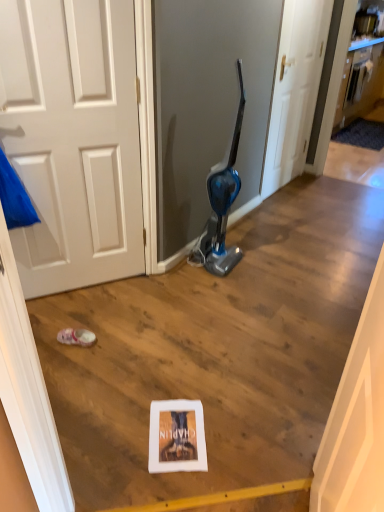
Question: Is wooden cabinet at upper right situated inside white matte door at center or outside?

Choices:
 (A) outside
 (B) inside

Answer: (A)

Question: In terms of height, does wooden cabinet at upper right look taller or shorter compared to white matte door at center?

Choices:
 (A) short
 (B) tall

Answer: (A)

Question: Estimate the real-world distances between objects in this image. Which object is farther from the wooden cabinet at upper right?

Choices:
 (A) pink fabric shoe at lower left
 (B) white matte door at center

Answer: (A)

Question: Which object is the farthest from the wooden cabinet at upper right?

Choices:
 (A) white matte door at center
 (B) pink fabric shoe at lower left

Answer: (B)